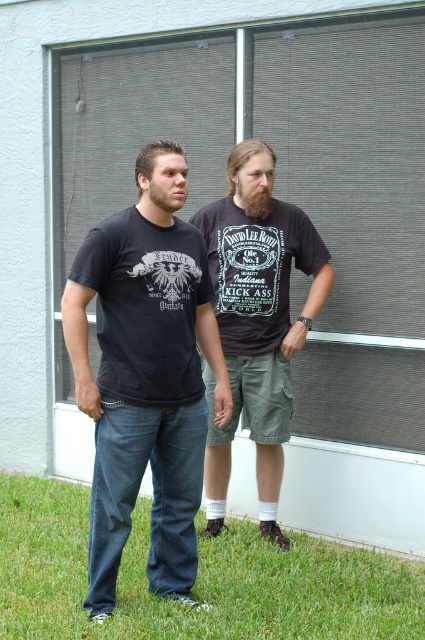
You are a delivery person holding a package that requires a signature. You see the gray mesh screen door at center and the brown fuzzy beard at center. Which object is closer to you, the delivery person?

The brown fuzzy beard at center is closer to you because the distance between the gray mesh screen door at center and the brown fuzzy beard at center is 1.58 meters, so the beard is nearer than the door.

You are standing at the edge of the grassy area and want to walk towards the building. Is the green grass at lower center directly in front of you or to the side?

The green grass at lower center is located at point (195,580), which places it directly in front of you as you face the building.